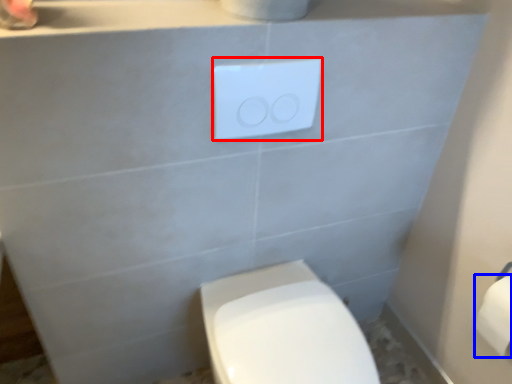
Question: Which of the following is the farthest to the observer, light switch (highlighted by a red box) or toilet paper (highlighted by a blue box)?

Choices:
 (A) light switch
 (B) toilet paper

Answer: (B)